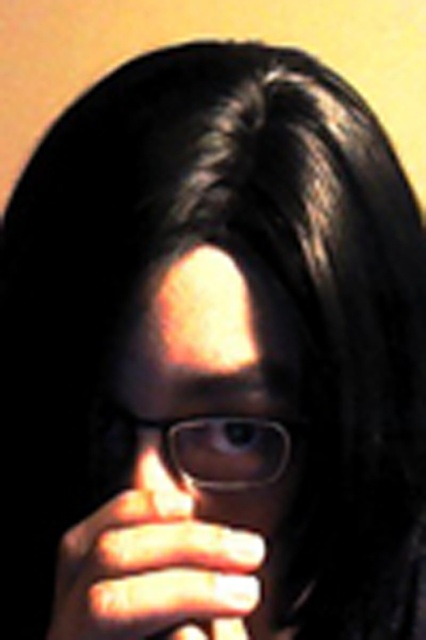
Question: Considering the real-world distances, which object is farthest from the satin white hand at center?

Choices:
 (A) matte black glasses at center
 (B) transparent plastic glasses at center
 (C) translucent glass nose at center

Answer: (B)

Question: Observing the image, what is the correct spatial positioning of matte black glasses at center in reference to translucent glass nose at center?

Choices:
 (A) below
 (B) above

Answer: (A)

Question: Which of the following is the closest to the observer?

Choices:
 (A) translucent glass nose at center
 (B) satin white hand at center

Answer: (B)

Question: In this image, where is matte black glasses at center located relative to satin white hand at center?

Choices:
 (A) below
 (B) above

Answer: (B)

Question: Does satin white hand at center appear under transparent plastic glasses at center?

Choices:
 (A) no
 (B) yes

Answer: (B)

Question: Among these objects, which one is nearest to the camera?

Choices:
 (A) translucent glass nose at center
 (B) transparent plastic glasses at center

Answer: (B)